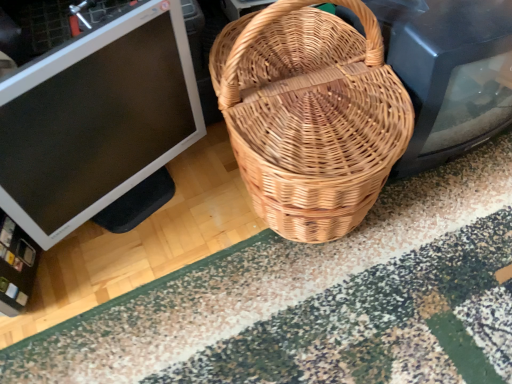
This screenshot has height=384, width=512. Find the location of `free space on the front side of matte black monitor at left`. free space on the front side of matte black monitor at left is located at coordinates (135, 299).